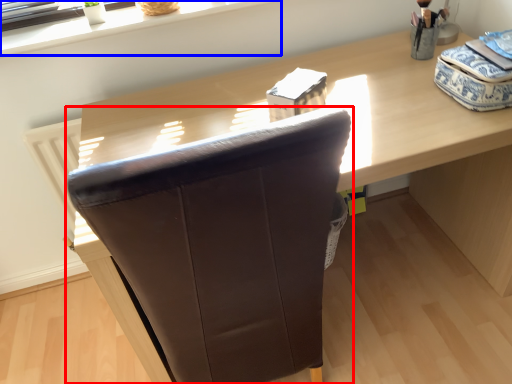
Question: Among these objects, which one is nearest to the camera, chair (highlighted by a red box) or window sill (highlighted by a blue box)?

Choices:
 (A) chair
 (B) window sill

Answer: (A)